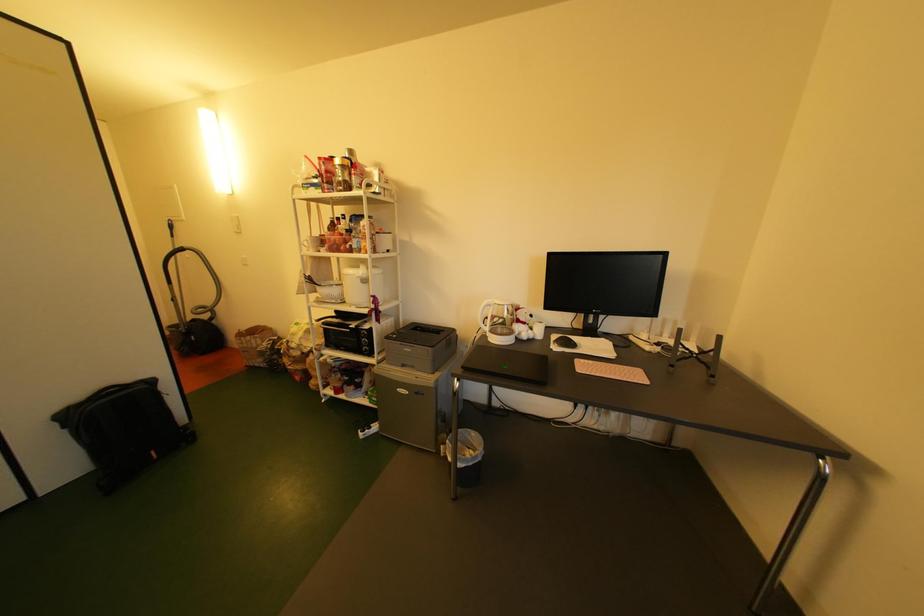
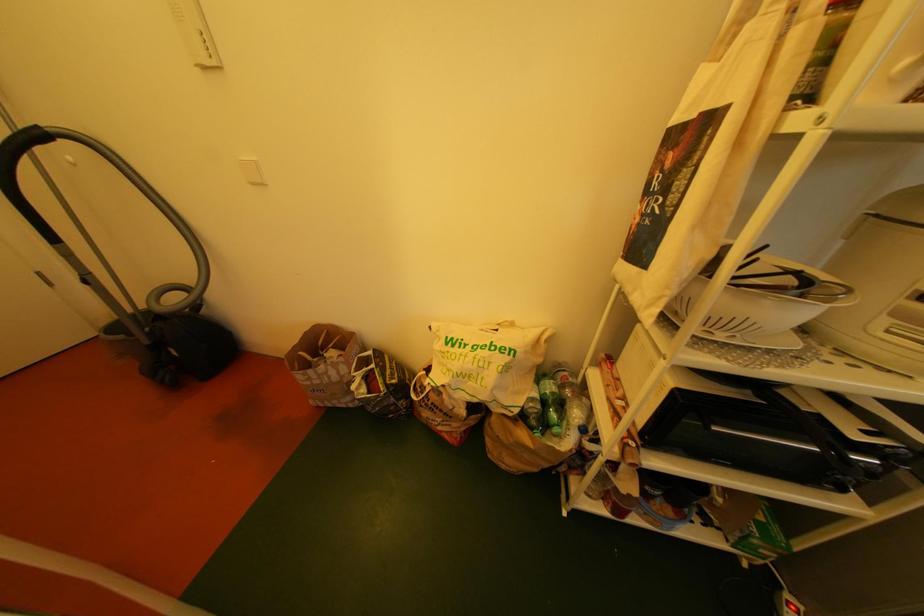
The images are taken continuously from a first-person perspective. In which direction are you moving?

The cameraman walked toward left, forward.